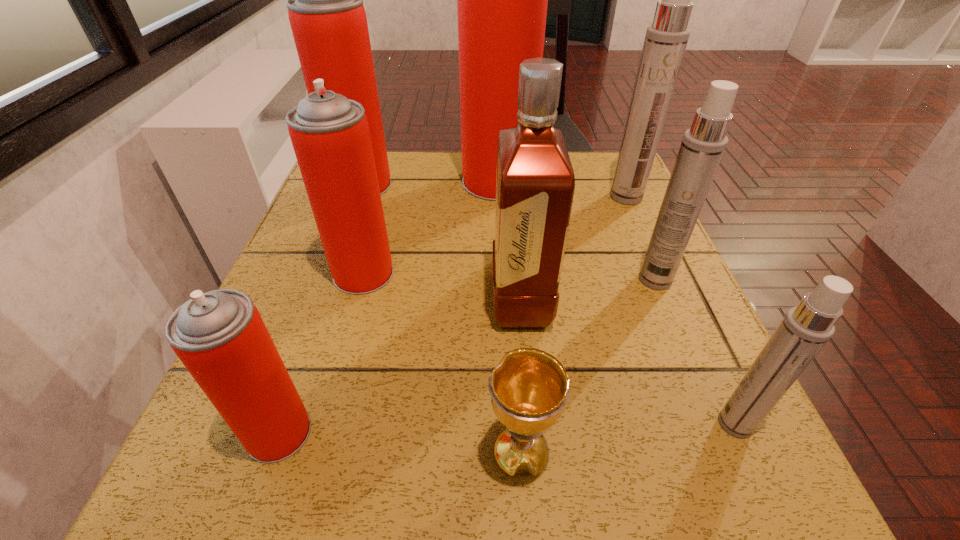
I want to click on white aerosol can that is the closest to the second biggest red aerosol can, so click(x=666, y=39).

Locate an element on the screen. The width and height of the screenshot is (960, 540). free space that satisfies the following two spatial constraints: 1. on the front side of the second farthest white aerosol can; 2. on the left side of the smallest white aerosol can is located at coordinates (716, 424).

Where is `vacant space that satisfies the following two spatial constraints: 1. on the back side of the shortest object; 2. on the left side of the farthest white aerosol can`? vacant space that satisfies the following two spatial constraints: 1. on the back side of the shortest object; 2. on the left side of the farthest white aerosol can is located at coordinates (502, 197).